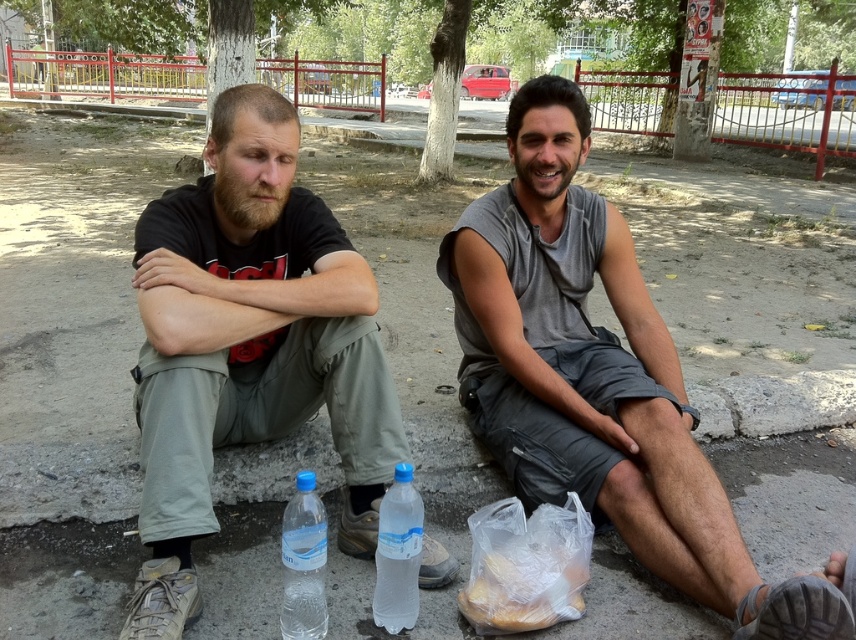
You are a delivery person who needs to pack these items into a box. The box can only hold items that are smaller than the gray fabric sleeve at lower right. Can the translucent plastic bag of bread at lower center fit into the box?

The translucent plastic bag of bread at lower center has a smaller size compared to the gray fabric sleeve at lower right, so it can fit into the box.

You are a photographer standing in front of the scene. You want to take a photo that includes both the matte black shirt at center and the transparent plastic bottle at center. Which object will appear larger in the photo?

The matte black shirt at center will appear larger in the photo because it is closer to the viewer than the transparent plastic bottle at center.

You are a delivery robot that needs to place a small package between the translucent plastic bag of bread at lower center and the gray fabric sleeve at lower right. The package requires at least 20 inches of space. Can you fit it there?

The distance between the translucent plastic bag of bread at lower center and the gray fabric sleeve at lower right is 19.28 inches, which is less than the required 20 inches. Therefore, the package cannot be placed there.